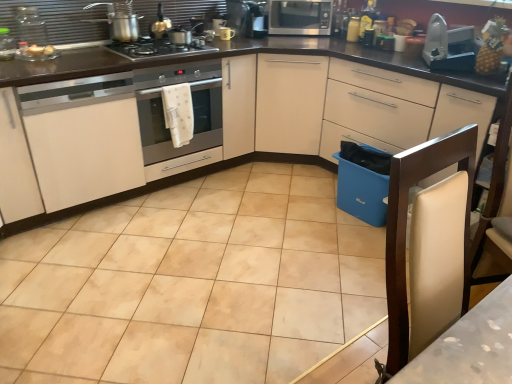
Where is `empty space that is in between stainless steel cooktop at upper center and metallic silver pot at upper left`? This screenshot has width=512, height=384. empty space that is in between stainless steel cooktop at upper center and metallic silver pot at upper left is located at coordinates (108, 55).